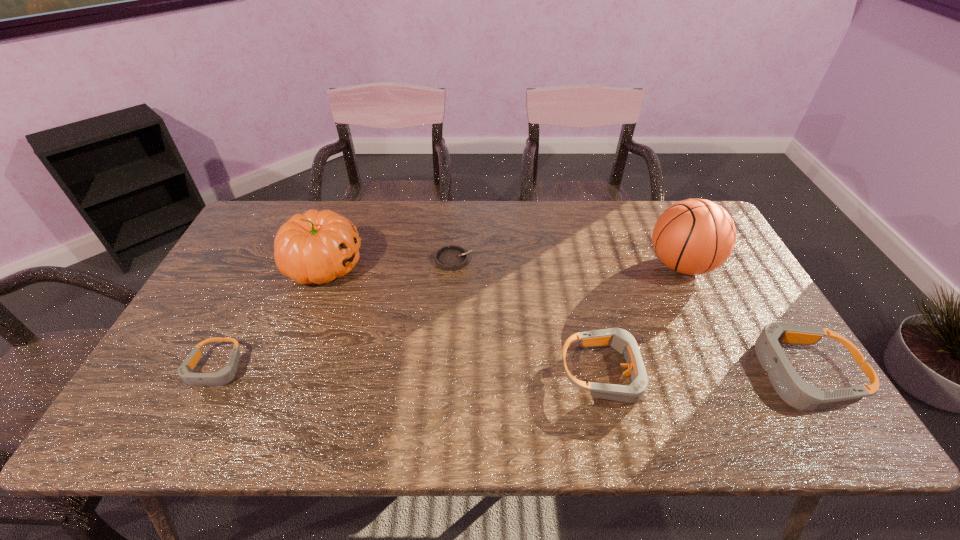
What are the coordinates of `the second shortest object` in the screenshot? It's located at (225, 375).

Where is `the leftmost goggles`? the leftmost goggles is located at coordinates (225, 375).

I want to click on the third object from right to left, so click(x=621, y=340).

Image resolution: width=960 pixels, height=540 pixels. Find the location of `the third shortest object`. the third shortest object is located at coordinates (621, 340).

Image resolution: width=960 pixels, height=540 pixels. Identify the location of the rightmost goggles. (795, 391).

At what (x,y) coordinates should I click in order to perform the action: click on ashtray. Please return your answer as a coordinate pair (x, y). Looking at the image, I should click on (450, 258).

Where is `the shortest object`? the shortest object is located at coordinates (450, 258).

You are a GUI agent. You are given a task and a screenshot of the screen. Output one action in this format:
    pyautogui.click(x=<x>, y=<y>)
    Task: Click on the pumpkin
    The height and width of the screenshot is (540, 960).
    Given the screenshot: What is the action you would take?
    pyautogui.click(x=316, y=247)

Where is `basketball`? This screenshot has width=960, height=540. basketball is located at coordinates (695, 236).

Identify the location of free location located on the front and back of the fourth tallest object. (762, 373).